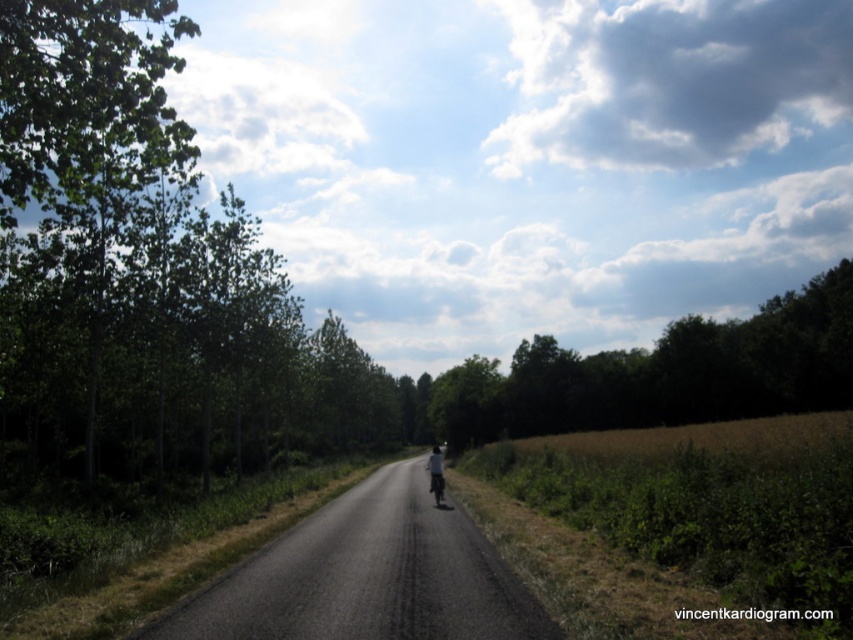
Question: Can you confirm if green leafy tree at upper left is positioned below shiny silver motorcycle at center?

Choices:
 (A) no
 (B) yes

Answer: (A)

Question: Which of the following is the farthest from the observer?

Choices:
 (A) (440, 476)
 (B) (74, 45)
 (C) (438, 500)
 (D) (466, 371)

Answer: (D)

Question: Considering the real-world distances, which object is farthest from the shiny silver motorcycle at center?

Choices:
 (A) green leafy tree at upper left
 (B) dark gray fabric jacket at center
 (C) green leafy tree at upper center

Answer: (C)

Question: Does green leafy tree at upper center have a smaller size compared to green leafy tree at upper left?

Choices:
 (A) yes
 (B) no

Answer: (A)

Question: Does green leafy tree at upper left have a lesser width compared to shiny silver motorcycle at center?

Choices:
 (A) yes
 (B) no

Answer: (B)

Question: Which object is positioned closest to the shiny silver motorcycle at center?

Choices:
 (A) green leafy tree at upper left
 (B) green leafy tree at upper center

Answer: (A)